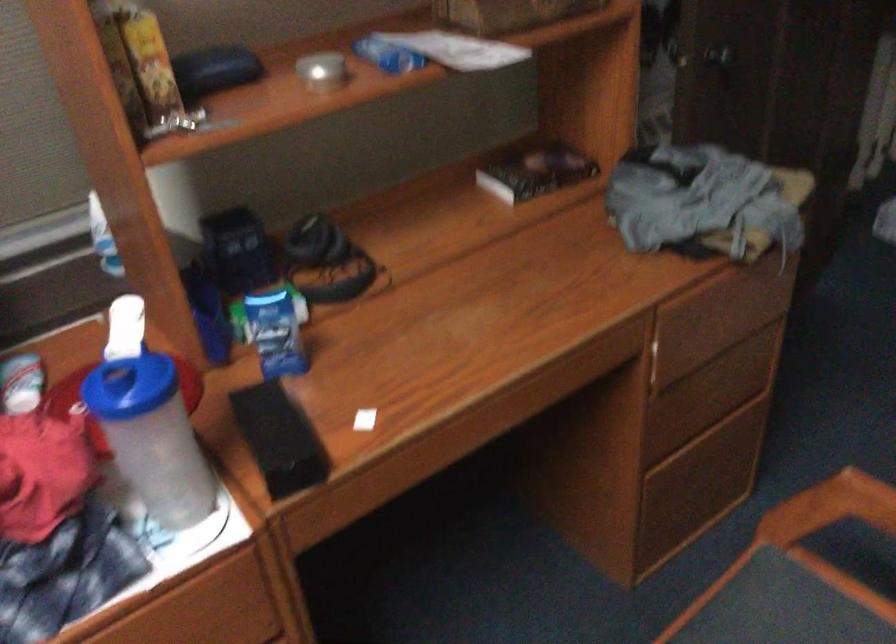
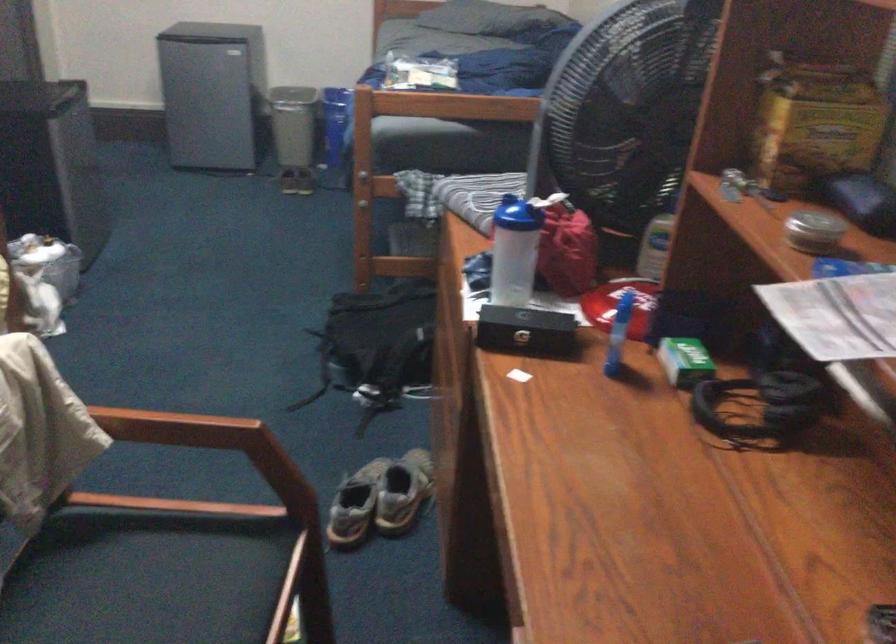
The point at (306,251) is marked in the first image. Where is the corresponding point in the second image?

(767, 397)